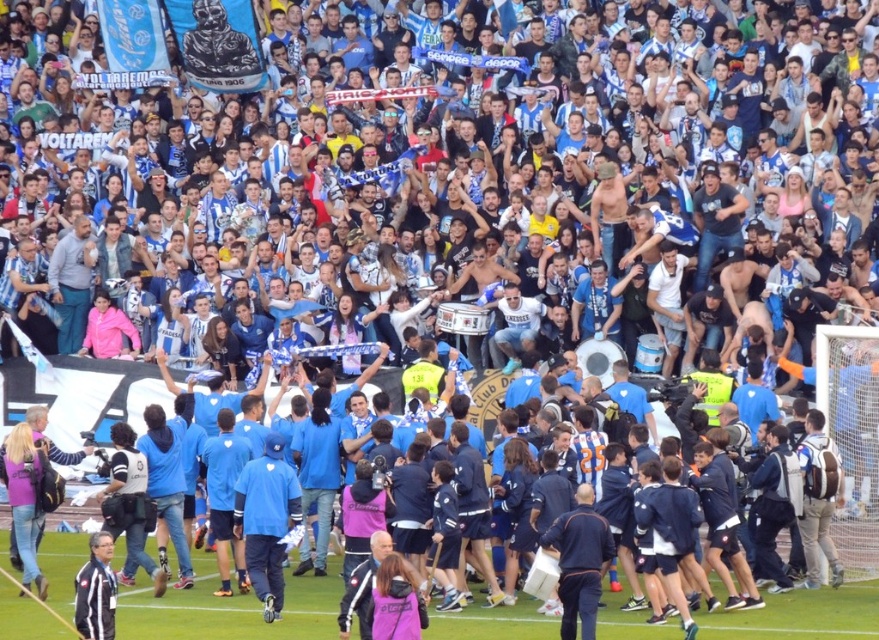
Is point (178, 611) behind point (9, 637)?

Yes, point (178, 611) is behind point (9, 637).

Is point (761, 611) less distant than point (557, 630)?

No.

Where is `blue fabric jersey at center`? This screenshot has height=640, width=879. blue fabric jersey at center is located at coordinates (229, 609).